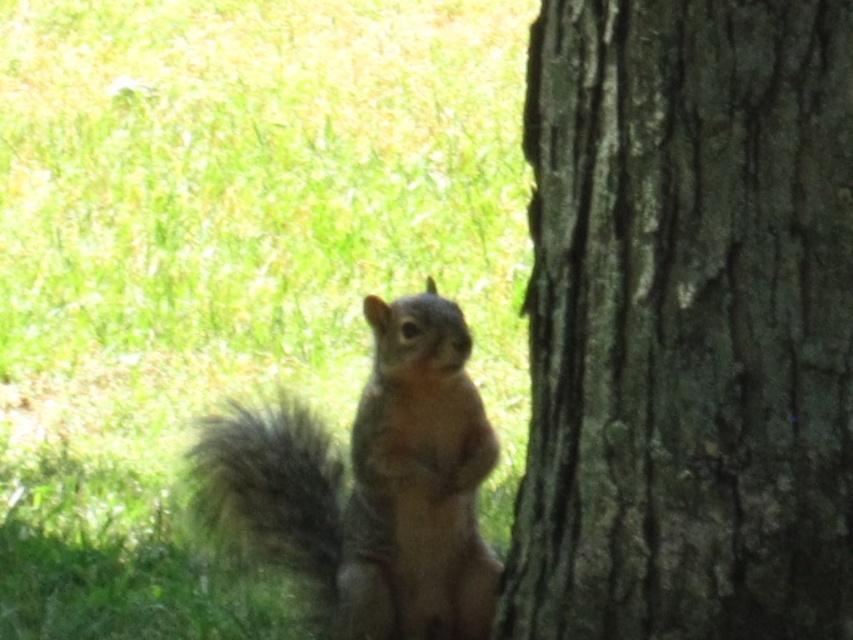
Question: Among these points, which one is farthest from the camera?

Choices:
 (A) (28, 157)
 (B) (851, 308)
 (C) (260, 440)

Answer: (A)

Question: Observing the image, what is the correct spatial positioning of green grass at lower left in reference to brown furry squirrel at center?

Choices:
 (A) above
 (B) below

Answer: (A)

Question: Is green grass at lower left below brown furry squirrel at center?

Choices:
 (A) no
 (B) yes

Answer: (A)

Question: Which is farther from the green grass at lower left?

Choices:
 (A) dark brown rough bark at right
 (B) brown furry squirrel at center

Answer: (A)

Question: Can you confirm if green grass at lower left is bigger than brown furry squirrel at center?

Choices:
 (A) yes
 (B) no

Answer: (A)

Question: Among these points, which one is farthest from the camera?

Choices:
 (A) (415, 532)
 (B) (610, 273)
 (C) (154, 109)

Answer: (C)